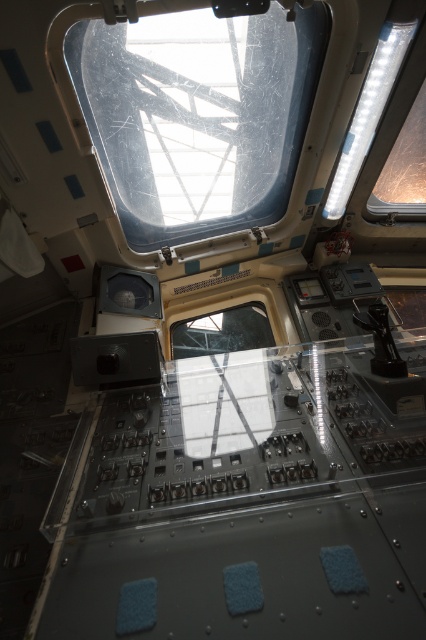
Consider the image. Measure the distance from transparent plastic window at upper right to transparent glass window at upper right.

transparent plastic window at upper right and transparent glass window at upper right are 53.16 centimeters apart.

Which is in front, point (333, 177) or point (423, 93)?

Point (423, 93) is in front.

Where is `transparent plastic window at upper right`? transparent plastic window at upper right is located at coordinates click(368, 113).

Does transparent plastic window at upper center appear on the left side of transparent glass window at upper right?

Yes, transparent plastic window at upper center is to the left of transparent glass window at upper right.

Does point (126, 227) come farther from viewer compared to point (367, 204)?

That is False.

This screenshot has width=426, height=640. What do you see at coordinates (198, 115) in the screenshot?
I see `transparent plastic window at upper center` at bounding box center [198, 115].

Find the location of a particular element. Image resolution: width=426 pixels, height=640 pixels. transparent plastic window at upper center is located at coordinates (198, 115).

Who is positioned more to the right, transparent plastic window at upper center or transparent plastic window at upper right?

Positioned to the right is transparent plastic window at upper right.

Where is `transparent plastic window at upper center`? transparent plastic window at upper center is located at coordinates (198, 115).

Identify the location of transparent plastic window at upper center. The height and width of the screenshot is (640, 426). (198, 115).